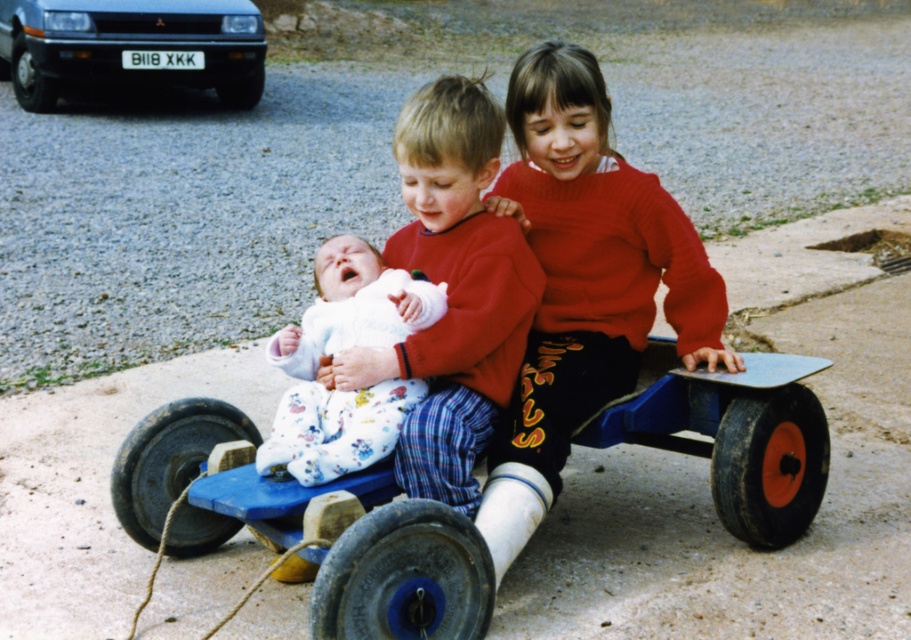
You are a photographer trying to capture the baby in the white fleece in the center of the image. The image coordinates are given as a point at [335,353]. Where exactly should you focus your camera to ensure the baby is in the center of your shot?

The point at [335,353] indicates the exact center position of the white fleece baby, so you should focus your camera on that coordinate to center the baby in your shot.

You are a photographer trying to capture a photo of the white fleece baby at center and the silver metallic car at upper left. Since you want the baby to appear larger in the photo than the car, where should you position the camera relative to them?

To make the white fleece baby at center appear larger than the silver metallic car at upper left in the photo, you should position the camera closer to the white fleece baby at center since it is smaller in size compared to the silver metallic car at upper left.

You are a photographer trying to capture a photo of the silver metallic car at upper left and the blue plastic wagon at center. Based on their positions, which object should you focus on first if you want to include both in your shot without moving the camera?

The silver metallic car at upper left should be focused on first since the blue plastic wagon at center is to the right of it, meaning the wagon is closer to the camera. By focusing on the car first, you can ensure both objects are in the frame without needing to adjust the camera position.